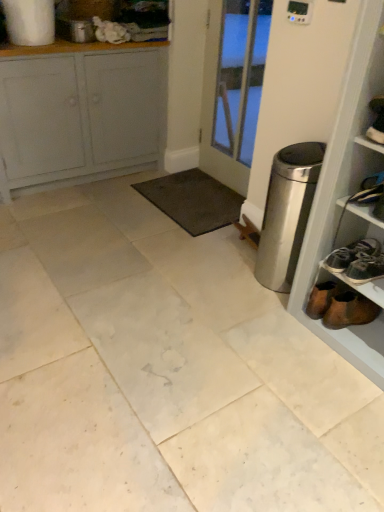
I want to click on space that is in front of stainless steel trash can at right, so click(x=269, y=317).